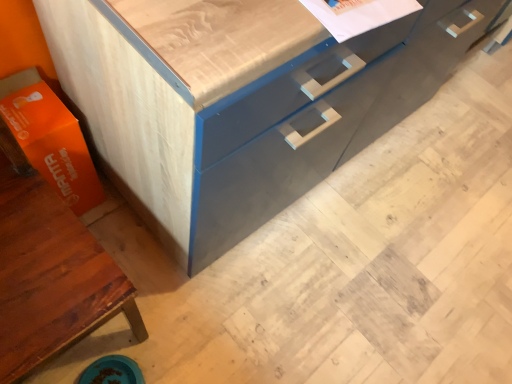
Question: Is matte wood cabinet at lower left inside the boundaries of orange matte cardboard box at lower left, or outside?

Choices:
 (A) outside
 (B) inside

Answer: (A)

Question: Considering the positions of matte wood cabinet at lower left and orange matte cardboard box at lower left in the image, is matte wood cabinet at lower left wider or thinner than orange matte cardboard box at lower left?

Choices:
 (A) wide
 (B) thin

Answer: (A)

Question: Estimate the real-world distances between objects in this image. Which object is farther from the matte gray cabinet at center?

Choices:
 (A) orange matte cardboard box at lower left
 (B) matte wood cabinet at lower left

Answer: (B)

Question: Based on their relative distances, which object is farther from the matte wood cabinet at lower left?

Choices:
 (A) orange matte cardboard box at lower left
 (B) matte gray cabinet at center

Answer: (B)